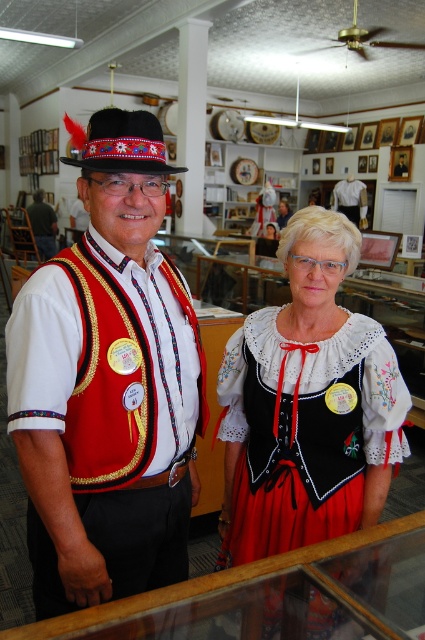
Question: Which point is closer to the camera?

Choices:
 (A) matte red vest at left
 (B) embroidered cotton blouse at center
 (C) matte red vest at center

Answer: (A)

Question: Does matte red vest at left have a larger size compared to embroidered cotton blouse at center?

Choices:
 (A) no
 (B) yes

Answer: (A)

Question: Among these objects, which one is nearest to the camera?

Choices:
 (A) matte red vest at left
 (B) embroidered cotton blouse at center

Answer: (A)

Question: Estimate the real-world distances between objects in this image. Which object is closer to the embroidered cotton blouse at center?

Choices:
 (A) matte red vest at left
 (B) matte red vest at center

Answer: (A)

Question: Can you confirm if embroidered cotton blouse at center is smaller than matte red vest at center?

Choices:
 (A) no
 (B) yes

Answer: (B)

Question: Does matte red vest at left have a lesser width compared to matte red vest at center?

Choices:
 (A) yes
 (B) no

Answer: (A)